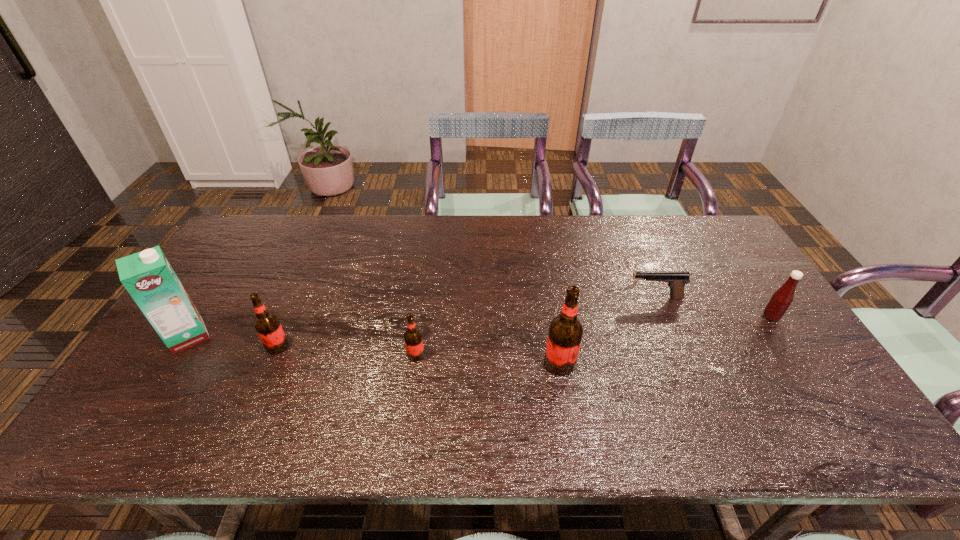
Identify the location of free spot that satisfies the following two spatial constraints: 1. at the muzzle of the pistol; 2. on the front side of the tallest root beer. (683, 363).